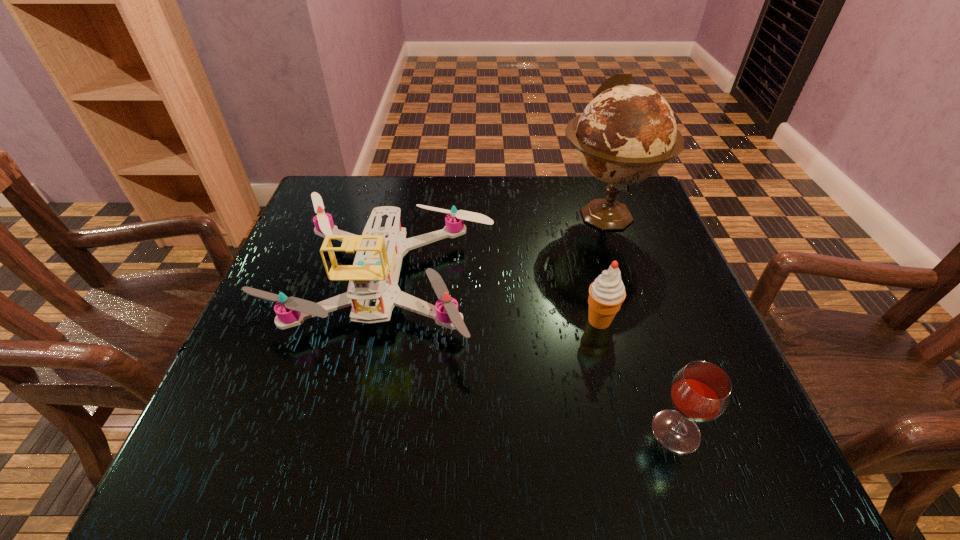
Find the location of `drone situated at the far edge`. drone situated at the far edge is located at coordinates (373, 291).

The image size is (960, 540). In order to click on object located in the near edge section of the desktop in this screenshot , I will do `click(700, 392)`.

The image size is (960, 540). Find the location of `object present at the left edge`. object present at the left edge is located at coordinates (373, 291).

Where is `globe located in the right edge section of the desktop`? The height and width of the screenshot is (540, 960). globe located in the right edge section of the desktop is located at coordinates (626, 133).

Where is `wineglass present at the right edge`? wineglass present at the right edge is located at coordinates (700, 392).

Locate an element on the screen. The image size is (960, 540). object that is at the far left corner is located at coordinates (373, 291).

In order to click on object present at the far right corner in this screenshot , I will do `click(626, 133)`.

Where is `object positioned at the near right corner`? This screenshot has height=540, width=960. object positioned at the near right corner is located at coordinates (700, 392).

Identify the location of vacant space at the far edge of the desktop. [x=426, y=225].

Where is `vacant space at the near edge of the desktop`? vacant space at the near edge of the desktop is located at coordinates 552,482.